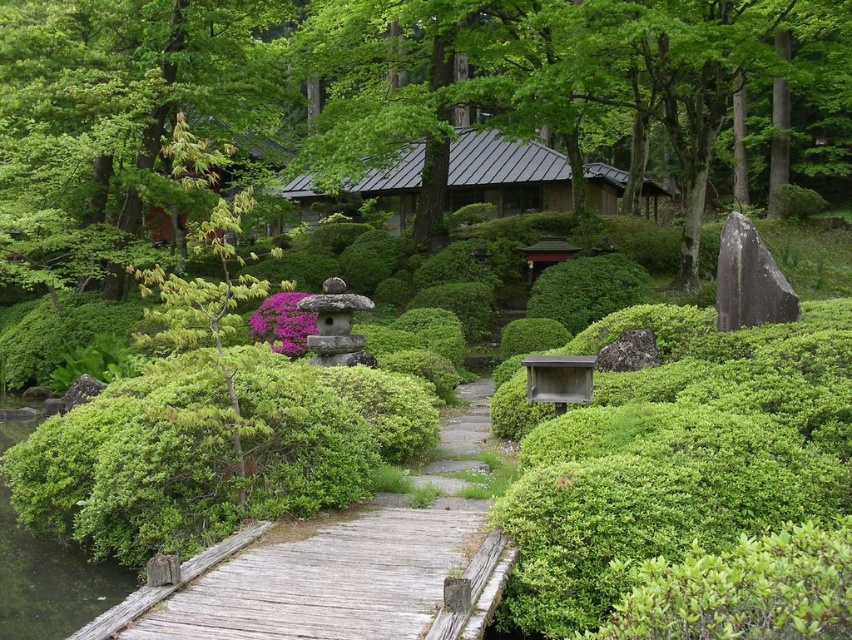
Question: Which object appears farthest from the camera in this image?

Choices:
 (A) green leafy bush at right
 (B) wooden at left
 (C) green leafy tree at upper left

Answer: (C)

Question: Is green leafy tree at upper left below wooden at left?

Choices:
 (A) yes
 (B) no

Answer: (B)

Question: Which of the following is the closest to the observer?

Choices:
 (A) wooden at left
 (B) green leafy tree at upper left
 (C) green leafy bush at right

Answer: (A)

Question: Is green leafy bush at right positioned in front of wooden at left?

Choices:
 (A) no
 (B) yes

Answer: (A)

Question: Can you confirm if green leafy tree at upper center is positioned below green leafy tree at upper left?

Choices:
 (A) no
 (B) yes

Answer: (A)

Question: Which object appears closest to the camera in this image?

Choices:
 (A) green leafy bush at right
 (B) green leafy tree at upper left
 (C) green leafy tree at upper center
 (D) wooden at left

Answer: (D)